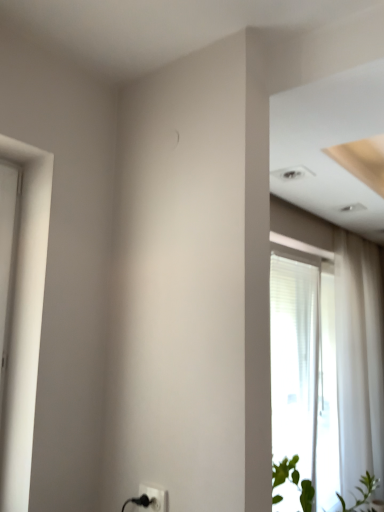
Question: In the image, is black plastic electric outlet at lower center positioned in front of or behind green leafy plant at lower right?

Choices:
 (A) front
 (B) behind

Answer: (B)

Question: Looking at their shapes, would you say black plastic electric outlet at lower center is wider or thinner than green leafy plant at lower right?

Choices:
 (A) wide
 (B) thin

Answer: (B)

Question: Estimate the real-world distances between objects in this image. Which object is farther from the black plastic electric outlet at lower center?

Choices:
 (A) transparent glass window at right
 (B) green leafy plant at lower right
 (C) white sheer curtain at right

Answer: (C)

Question: Estimate the real-world distances between objects in this image. Which object is farther from the white sheer curtain at right?

Choices:
 (A) black plastic electric outlet at lower center
 (B) green leafy plant at lower right
 (C) transparent glass window at right

Answer: (A)